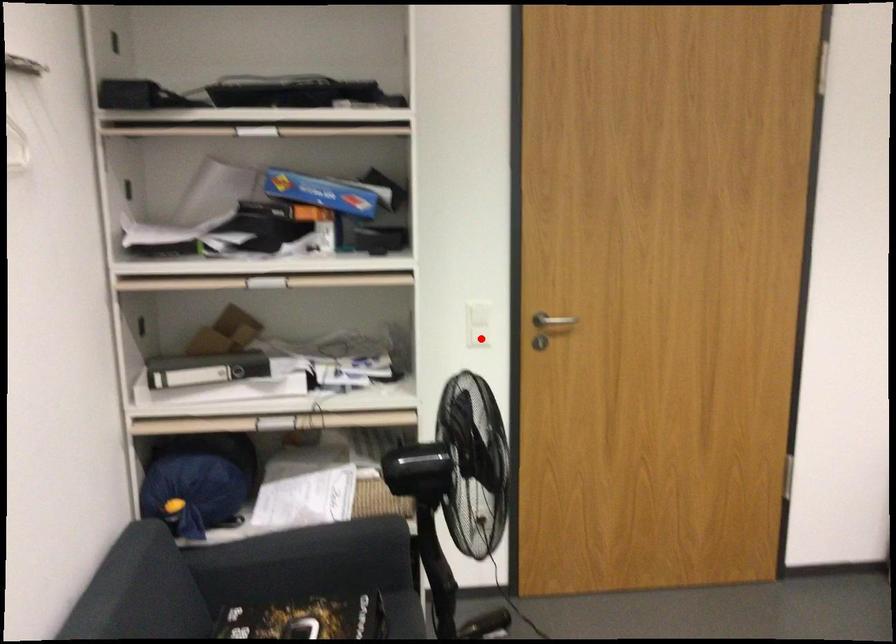
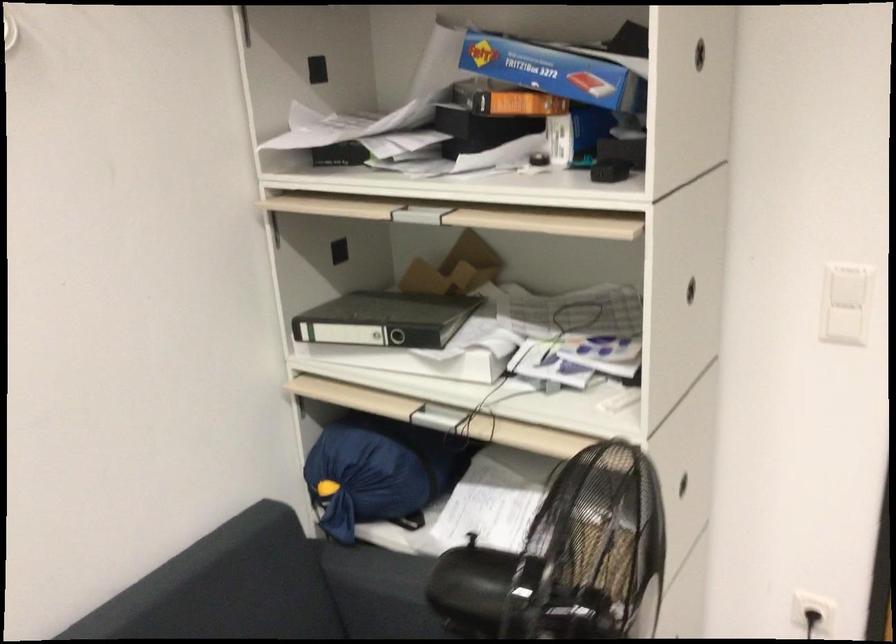
The point at the highlighted location is marked in the first image. Where is the corresponding point in the second image?

(843, 326)